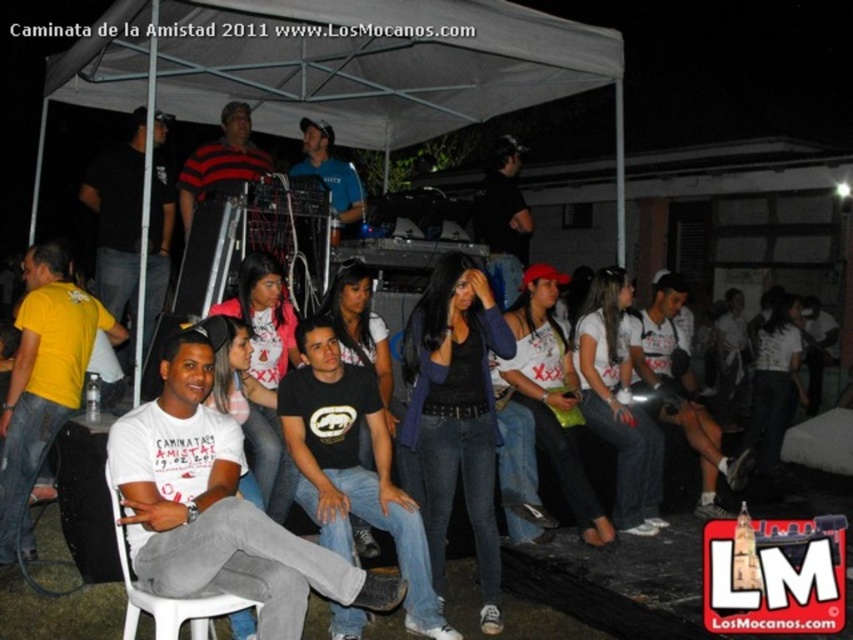
Question: Is white plastic chair at lower left to the right of blue matte shirt at center from the viewer's perspective?

Choices:
 (A) no
 (B) yes

Answer: (A)

Question: Which point is farther from the camera taking this photo?

Choices:
 (A) (68, 348)
 (B) (337, 177)

Answer: (B)

Question: Which object is farther from the camera taking this photo?

Choices:
 (A) matte yellow t-shirt at lower left
 (B) white cotton t-shirt at center

Answer: (A)

Question: Considering the real-world distances, which object is closest to the denim jeans at center?

Choices:
 (A) white cotton t-shirt at center
 (B) blue matte shirt at center
 (C) matte yellow t-shirt at lower left
 (D) white plastic chair at lower left

Answer: (A)

Question: Does white cotton t-shirt at center have a larger size compared to denim jeans at center?

Choices:
 (A) no
 (B) yes

Answer: (B)

Question: Does white cotton t-shirt at center have a larger size compared to denim jeans at center?

Choices:
 (A) no
 (B) yes

Answer: (B)